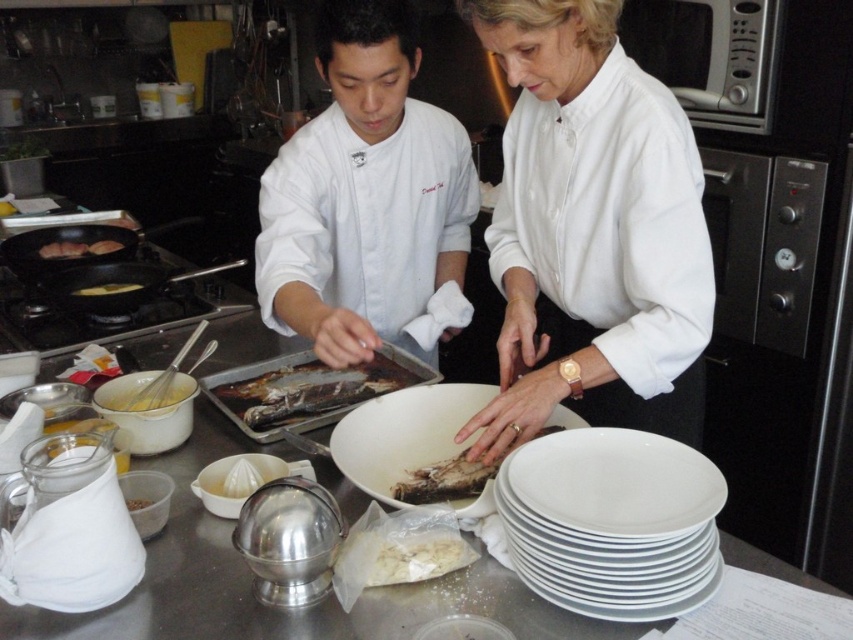
Question: Can you confirm if white matte chef coat at center is positioned above yellow matte fish at left?

Choices:
 (A) no
 (B) yes

Answer: (B)

Question: Which object is farther from the camera taking this photo?

Choices:
 (A) white matte chef coat at center
 (B) brown matte meat at center
 (C) charred wooden fish at center

Answer: (B)

Question: Is smooth white shirt at center smaller than white glossy plate at lower right?

Choices:
 (A) no
 (B) yes

Answer: (A)

Question: Is smooth white shirt at center bigger than white glossy plate at lower right?

Choices:
 (A) no
 (B) yes

Answer: (B)

Question: Which point is farther from the camera taking this photo?

Choices:
 (A) (637, 394)
 (B) (692, 467)
 (C) (384, 365)

Answer: (C)

Question: Which of the following is the farthest from the observer?

Choices:
 (A) (445, 470)
 (B) (651, 568)

Answer: (A)